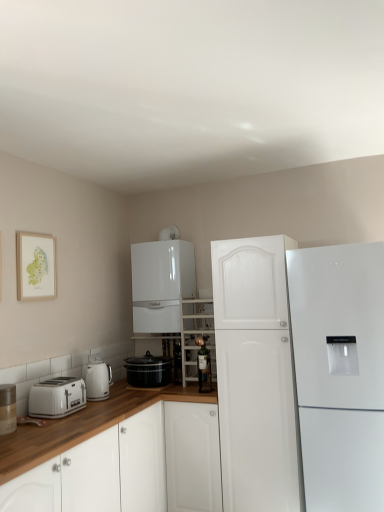
Image resolution: width=384 pixels, height=512 pixels. I want to click on free space above white plastic toaster at lower left (from a real-world perspective), so click(x=53, y=381).